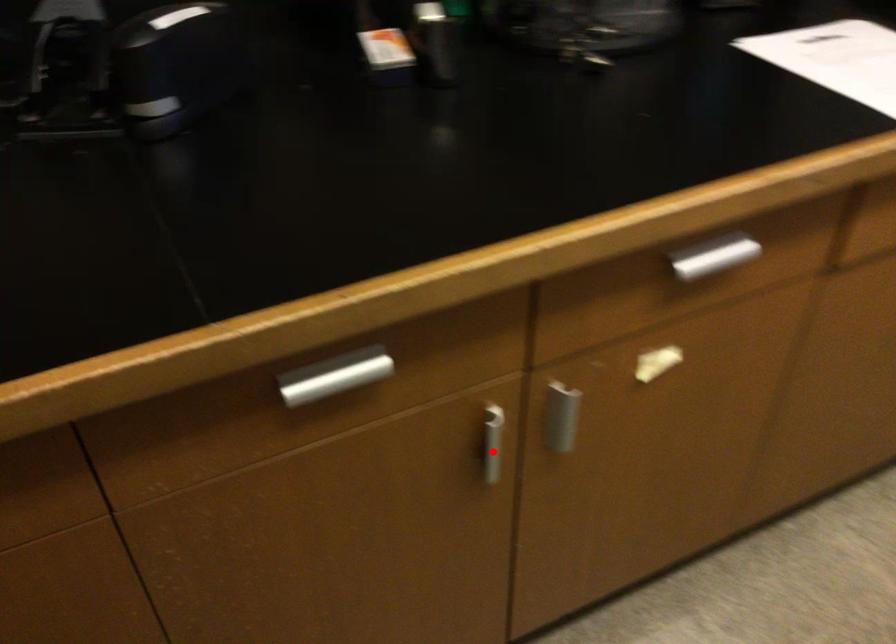
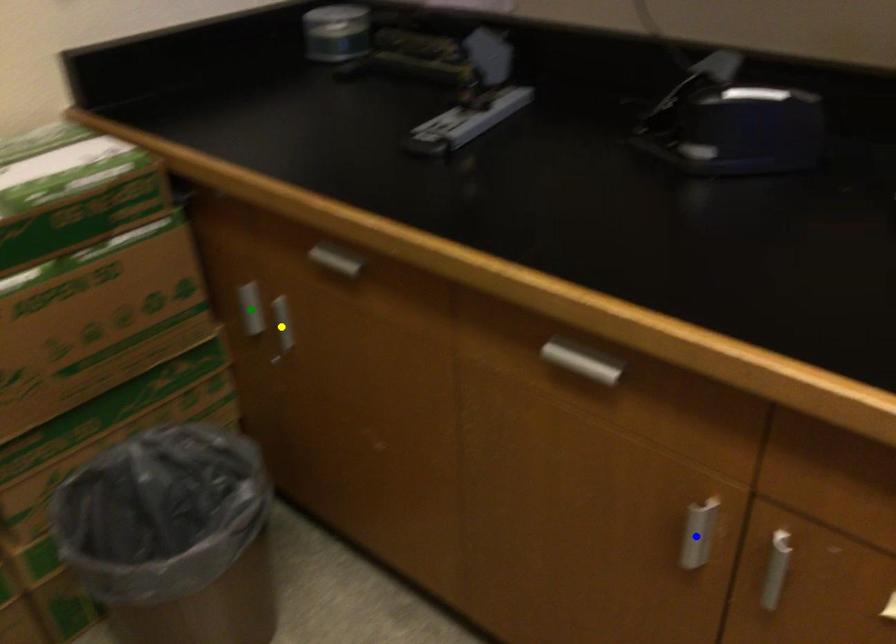
Question: I am providing you with two images of the same scene from different viewpoints. A red point is marked on the first image. You are given multiple points on the second image. Which mark in image 2 goes with the point in image 1?

Choices:
 (A) blue point
 (B) yellow point
 (C) green point

Answer: (A)